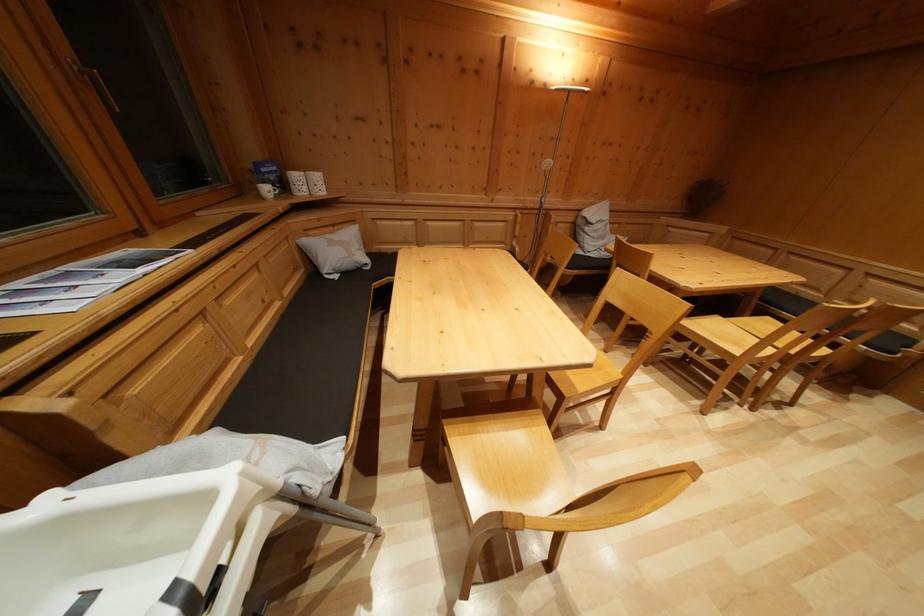
What do you see at coordinates (94, 84) in the screenshot?
I see `a window handle` at bounding box center [94, 84].